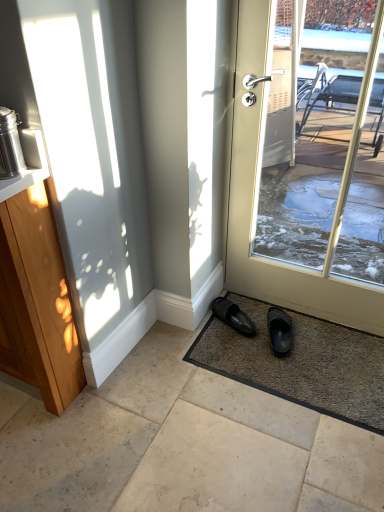
Find the location of a particular element. The width and height of the screenshot is (384, 512). vacant space to the right of black rubber slipper at lower right, which appears as the second footwear when viewed from the left is located at coordinates (320, 339).